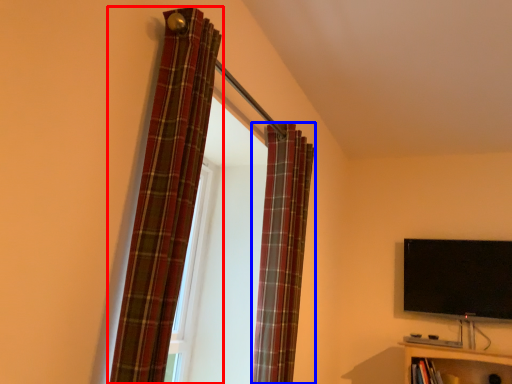
Question: Which of the following is the farthest to the observer, curtain (highlighted by a red box) or curtain (highlighted by a blue box)?

Choices:
 (A) curtain
 (B) curtain

Answer: (B)